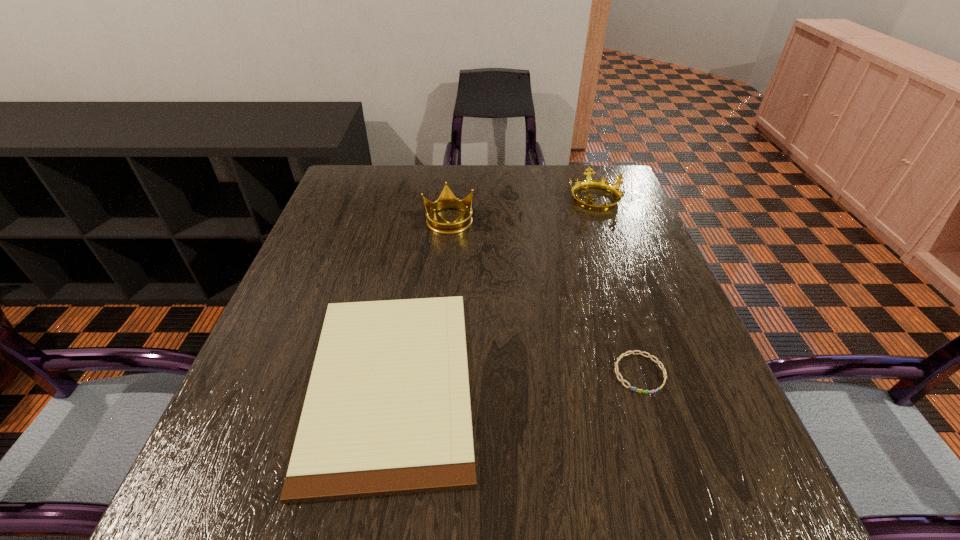
Select which object appears as the second closest to the clipboard. Please provide its 2D coordinates. Your answer should be formatted as a tuple, i.e. [(x, y)], where the tuple contains the x and y coordinates of a point satisfying the conditions above.

[(631, 352)]

Locate which object is the third closest to the second tallest object. Please provide its 2D coordinates. Your answer should be formatted as a tuple, i.e. [(x, y)], where the tuple contains the x and y coordinates of a point satisfying the conditions above.

[(631, 352)]